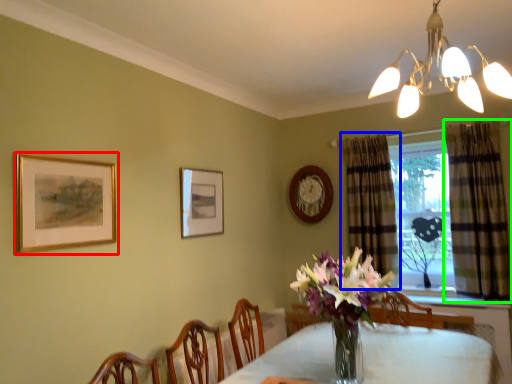
Question: Which object is positioned closest to picture frame (highlighted by a red box)? Select from curtain (highlighted by a blue box) and curtain (highlighted by a green box).

Choices:
 (A) curtain
 (B) curtain

Answer: (A)